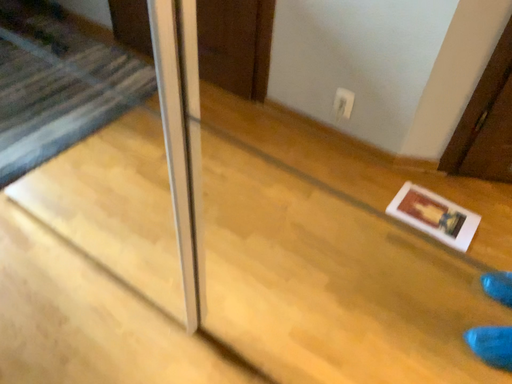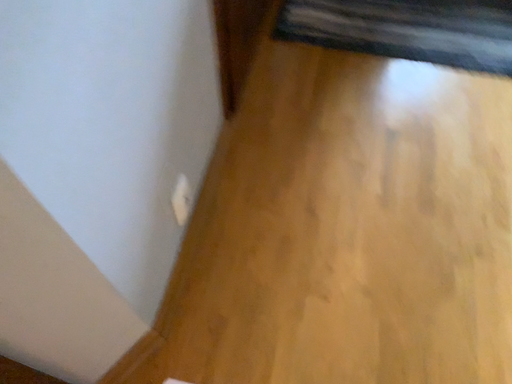
Question: How did the camera likely rotate when shooting the video?

Choices:
 (A) rotated downward
 (B) rotated upward

Answer: (B)